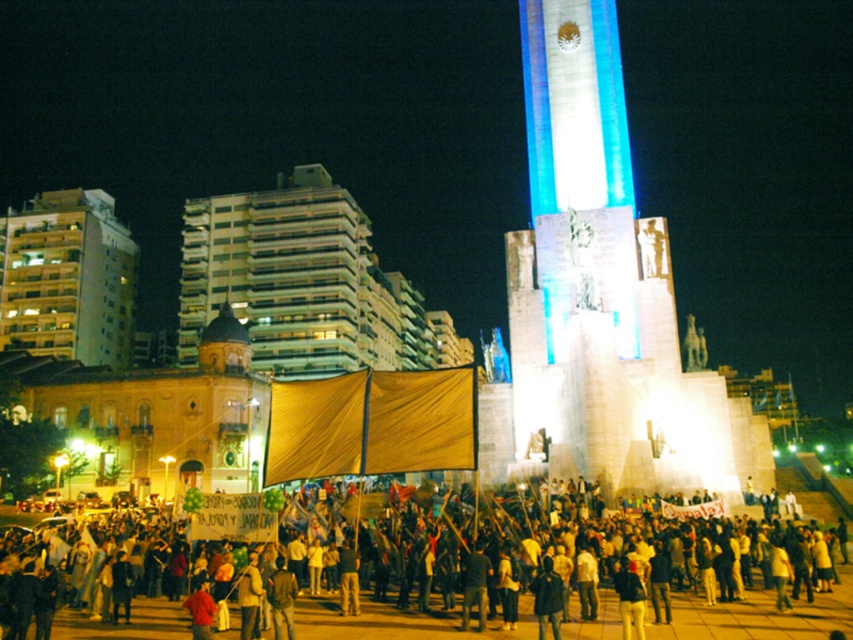
You are standing at the center of the public square and see the monument with the vertical blue and white striped column. There is a person in dark clothing at lower center marked by point (428, 573). Which direction should you walk to reach the monument first without going near the crowd?

To reach the monument first without going near the crowd, you should walk towards the monument directly from the center, as the person in dark clothing at lower center marked by point (428, 573) is located in the lower part of the square, away from the monument. This path avoids the crowd in front of the monument and heads straight toward the monument itself.

You are a city planner who wants to install a new streetlight between the white stone monument at center and the yellowish concrete building at left. The streetlight requires a minimum of 10 meters of space around it to be installed safely. Is there enough space between these two objects to place the streetlight?

The white stone monument at center and the yellowish concrete building at left are 96.15 meters apart from each other. Since the streetlight requires a minimum of 10 meters of space, there is sufficient distance between them to install the streetlight safely.